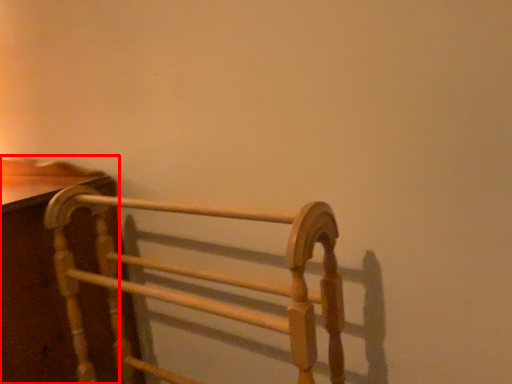
Question: From the image's perspective, what is the correct spatial positioning of furniture (annotated by the red box) in reference to furniture?

Choices:
 (A) above
 (B) below

Answer: (B)